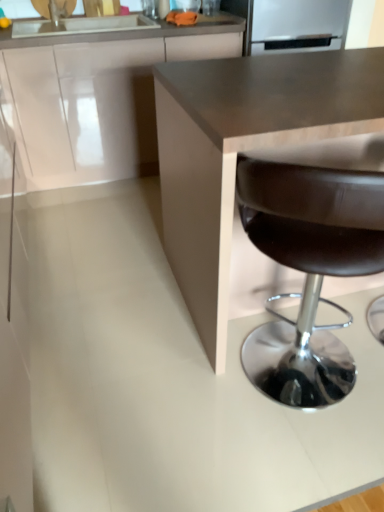
Question: Does satin silver refrigerator at upper center have a greater width compared to white glossy cabinet at upper left?

Choices:
 (A) no
 (B) yes

Answer: (B)

Question: Considering the relative positions of satin silver refrigerator at upper center and white glossy cabinet at upper left in the image provided, is satin silver refrigerator at upper center to the left of white glossy cabinet at upper left from the viewer's perspective?

Choices:
 (A) no
 (B) yes

Answer: (A)

Question: Is satin silver refrigerator at upper center shorter than white glossy cabinet at upper left?

Choices:
 (A) yes
 (B) no

Answer: (A)

Question: Is satin silver refrigerator at upper center located outside white glossy cabinet at upper left?

Choices:
 (A) yes
 (B) no

Answer: (A)

Question: Is satin silver refrigerator at upper center not near white glossy cabinet at upper left?

Choices:
 (A) no
 (B) yes

Answer: (A)

Question: Is satin silver refrigerator at upper center next to white glossy cabinet at upper left and touching it?

Choices:
 (A) yes
 (B) no

Answer: (B)

Question: Is brown leather stool at lower right with white glossy cabinet at upper left?

Choices:
 (A) no
 (B) yes

Answer: (A)

Question: From a real-world perspective, does brown leather stool at lower right sit lower than white glossy cabinet at upper left?

Choices:
 (A) yes
 (B) no

Answer: (A)

Question: Is brown leather stool at lower right to the left of white glossy cabinet at upper left from the viewer's perspective?

Choices:
 (A) no
 (B) yes

Answer: (A)

Question: From the image's perspective, does brown leather stool at lower right appear lower than white glossy cabinet at upper left?

Choices:
 (A) no
 (B) yes

Answer: (B)

Question: Is brown leather stool at lower right smaller than white glossy cabinet at upper left?

Choices:
 (A) no
 (B) yes

Answer: (B)

Question: Would you say brown leather stool at lower right contains white glossy cabinet at upper left?

Choices:
 (A) yes
 (B) no

Answer: (B)

Question: Does white glossy cabinet at upper left have a greater width compared to brown leather stool at lower right?

Choices:
 (A) yes
 (B) no

Answer: (A)